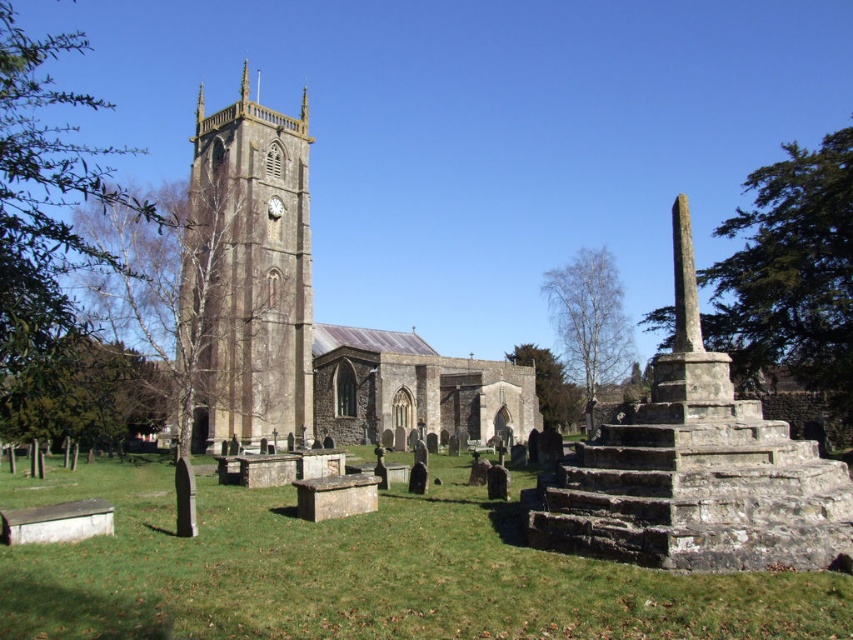
Question: Can you confirm if stone church at center is smaller than stone clock tower at left?

Choices:
 (A) no
 (B) yes

Answer: (A)

Question: Does green grassy at lower center have a smaller size compared to stone clock tower at left?

Choices:
 (A) yes
 (B) no

Answer: (A)

Question: Which object is closer to the camera taking this photo?

Choices:
 (A) stone clock tower at left
 (B) green grassy at lower center

Answer: (B)

Question: Which object is closer to the camera taking this photo?

Choices:
 (A) stone church at center
 (B) green grassy at lower center
 (C) stone clock tower at left

Answer: (B)

Question: Is stone church at center to the left of stone clock tower at left from the viewer's perspective?

Choices:
 (A) yes
 (B) no

Answer: (B)

Question: Among these points, which one is nearest to the camera?

Choices:
 (A) (256, 209)
 (B) (293, 420)
 (C) (193, 545)

Answer: (C)